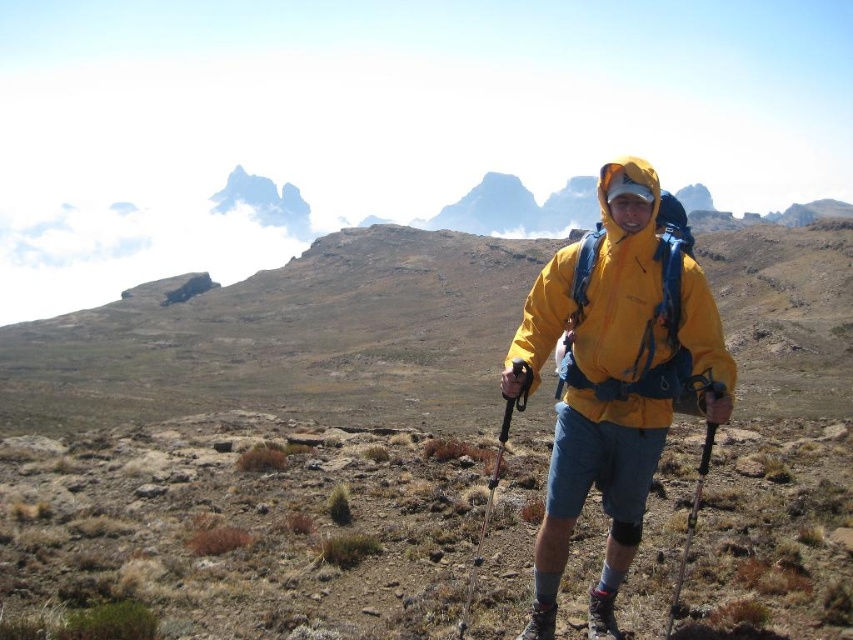
Does yellow waterproof jacket at center have a lesser height compared to black plastic ski pole at lower right?

No, yellow waterproof jacket at center is not shorter than black plastic ski pole at lower right.

Which is more to the right, yellow waterproof jacket at center or black plastic ski pole at lower right?

black plastic ski pole at lower right is more to the right.

Image resolution: width=853 pixels, height=640 pixels. What do you see at coordinates (619, 275) in the screenshot?
I see `yellow waterproof jacket at center` at bounding box center [619, 275].

Locate an element on the screen. yellow waterproof jacket at center is located at coordinates (619, 275).

Does point (589, 625) come farther from viewer compared to point (537, 609)?

Yes, it is.

Between point (618, 637) and point (537, 637), which one is positioned in front?

Positioned in front is point (537, 637).

The image size is (853, 640). I want to click on brushed leather hiking boot at lower center, so click(x=601, y=614).

Locate an element on the screen. This screenshot has width=853, height=640. brushed leather hiking boot at lower center is located at coordinates (601, 614).

Measure the distance between metallic silver ski pole at center and camera.

metallic silver ski pole at center is 18.60 meters from camera.

Can you confirm if metallic silver ski pole at center is positioned below matte black hiking boot at lower center?

No, metallic silver ski pole at center is not below matte black hiking boot at lower center.

Does point (469, 589) come farther from viewer compared to point (553, 618)?

That is True.

Image resolution: width=853 pixels, height=640 pixels. I want to click on metallic silver ski pole at center, so click(494, 483).